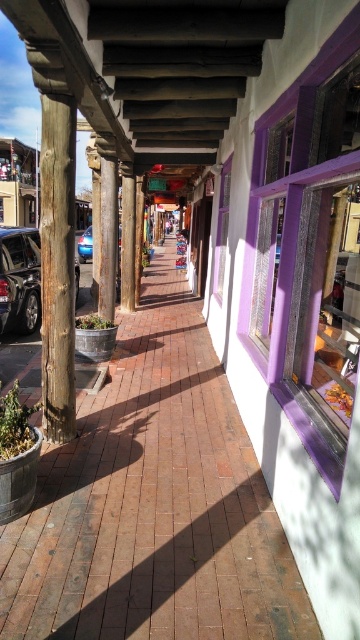
Can you confirm if brick pavement at center is wider than shiny blue sedan at center?

Correct, the width of brick pavement at center exceeds that of shiny blue sedan at center.

Can you confirm if brick pavement at center is taller than shiny blue sedan at center?

No.

Is point (42, 550) less distant than point (87, 253)?

Yes, point (42, 550) is in front of point (87, 253).

Image resolution: width=360 pixels, height=640 pixels. I want to click on brick pavement at center, so click(153, 500).

Can you confirm if brick pavement at center is positioned to the right of matte black car at left?

Yes, brick pavement at center is to the right of matte black car at left.

Which is more to the right, brick pavement at center or matte black car at left?

brick pavement at center

Is point (144, 333) more distant than point (36, 268)?

No, it is in front of (36, 268).

Locate an element on the screen. brick pavement at center is located at coordinates (153, 500).

Is weathered wood post at left closer to camera compared to matte black car at left?

Yes, weathered wood post at left is in front of matte black car at left.

Who is more distant from viewer, (x=65, y=284) or (x=75, y=298)?

Point (x=75, y=298)

You are a GUI agent. You are given a task and a screenshot of the screen. Output one action in this format:
    pyautogui.click(x=<x>, y=<y>)
    Task: Click on the weathered wood post at left
    The width and height of the screenshot is (360, 640).
    Given the screenshot: What is the action you would take?
    pyautogui.click(x=57, y=266)